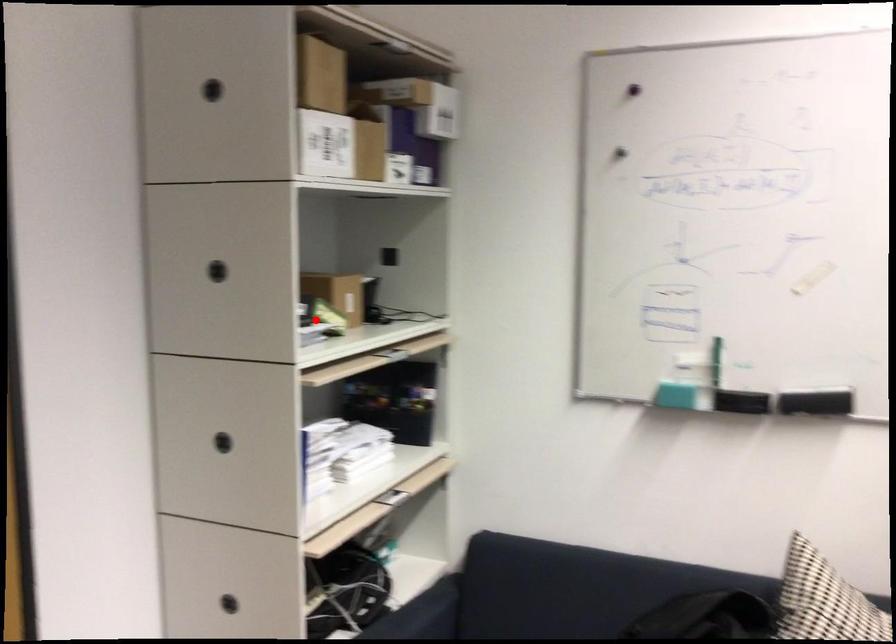
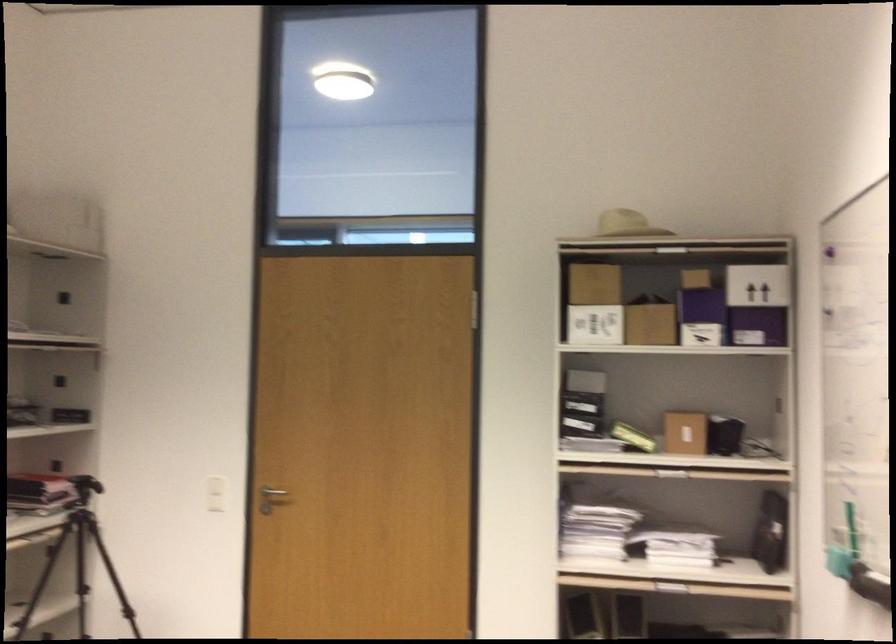
Question: I am providing you with two images of the same scene from different viewpoints. A red point is shown in image1. For the corresponding object point in image2, is it positioned nearer or farther from the camera?

Choices:
 (A) Nearer
 (B) Farther

Answer: (B)